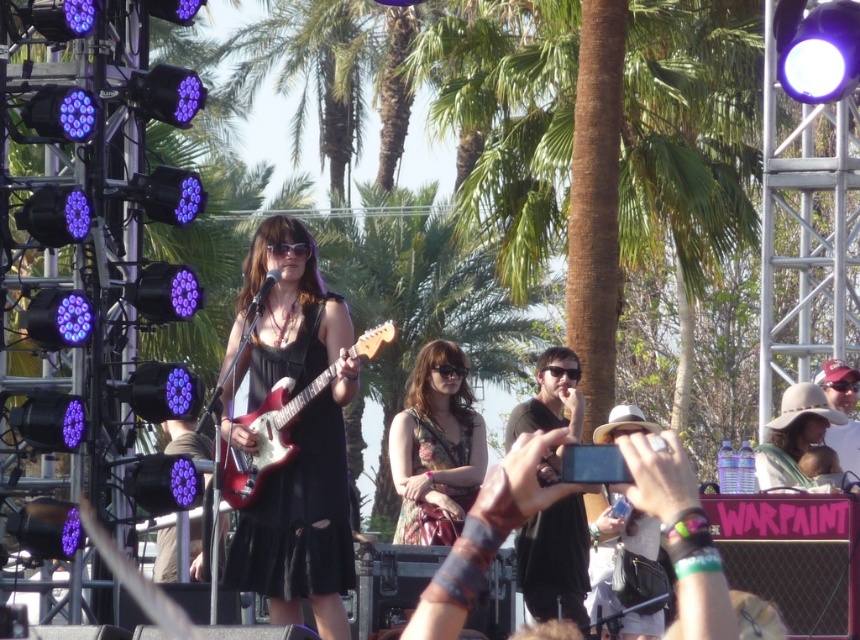
Find the location of `black matte shirt at center`. black matte shirt at center is located at coordinates (554, 561).

Is black matte shirt at center shorter than white fabric hat at lower right?

No, black matte shirt at center is not shorter than white fabric hat at lower right.

I want to click on black matte shirt at center, so click(x=554, y=561).

This screenshot has height=640, width=860. Identify the location of white fabric hat at lower right. (613, 547).

Does white fabric hat at lower right appear on the left side of matte white hat at upper right?

Correct, you'll find white fabric hat at lower right to the left of matte white hat at upper right.

This screenshot has height=640, width=860. In order to click on white fabric hat at lower right in this screenshot , I will do `click(613, 547)`.

Locate an element on the screen. This screenshot has height=640, width=860. white fabric hat at lower right is located at coordinates (613, 547).

Between black matte dress at center and beige fabric hat at lower right, which one is positioned higher?

black matte dress at center is above.

Which is in front, point (289, 580) or point (779, 481)?

Point (289, 580)

Where is `black matte dress at center`? The image size is (860, 640). black matte dress at center is located at coordinates pos(293,436).